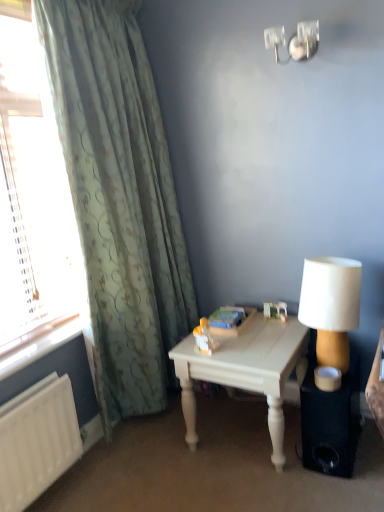
I want to click on blank area beneath white painted wood table at center (from a real-world perspective), so click(x=243, y=425).